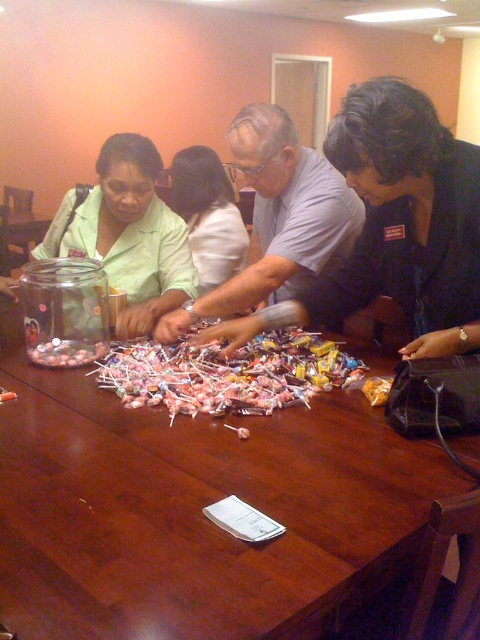
Question: Does matte green shirt at center have a larger size compared to white fabric shirt at center?

Choices:
 (A) yes
 (B) no

Answer: (A)

Question: Where is wooden table at center located in relation to matte gray shirt at center in the image?

Choices:
 (A) below
 (B) above

Answer: (A)

Question: Estimate the real-world distances between objects in this image. Which object is closer to the matte green shirt at center?

Choices:
 (A) matte gray shirt at center
 (B) pink glossy lollipops at center
 (C) wooden table at center

Answer: (A)

Question: Which point is closer to the camera taking this photo?

Choices:
 (A) (334, 218)
 (B) (241, 225)
 (C) (220, 356)
 (D) (322, 506)

Answer: (D)

Question: Among these points, which one is nearest to the camera?

Choices:
 (A) (62, 534)
 (B) (226, 380)
 (C) (252, 186)
 (D) (166, 307)

Answer: (A)

Question: From the image, what is the correct spatial relationship of wooden table at center in relation to white fabric shirt at center?

Choices:
 (A) left
 (B) right

Answer: (B)